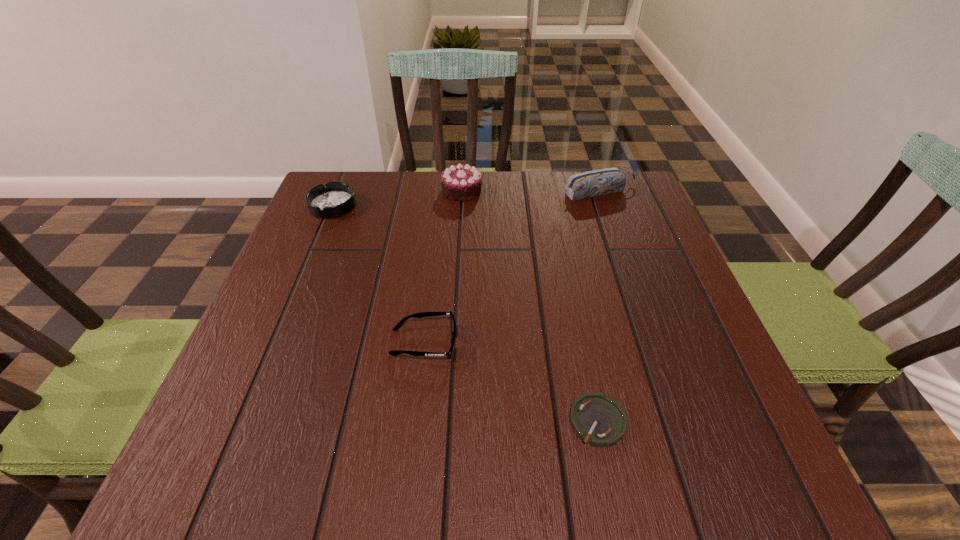
I want to click on vacant space that satisfies the following two spatial constraints: 1. on the front-facing side of the nearer ashtray; 2. on the left side of the sunglasses, so click(415, 421).

The width and height of the screenshot is (960, 540). Identify the location of blank area in the image that satisfies the following two spatial constraints: 1. on the back side of the right ashtray; 2. on the front-facing side of the second nearest object. (581, 342).